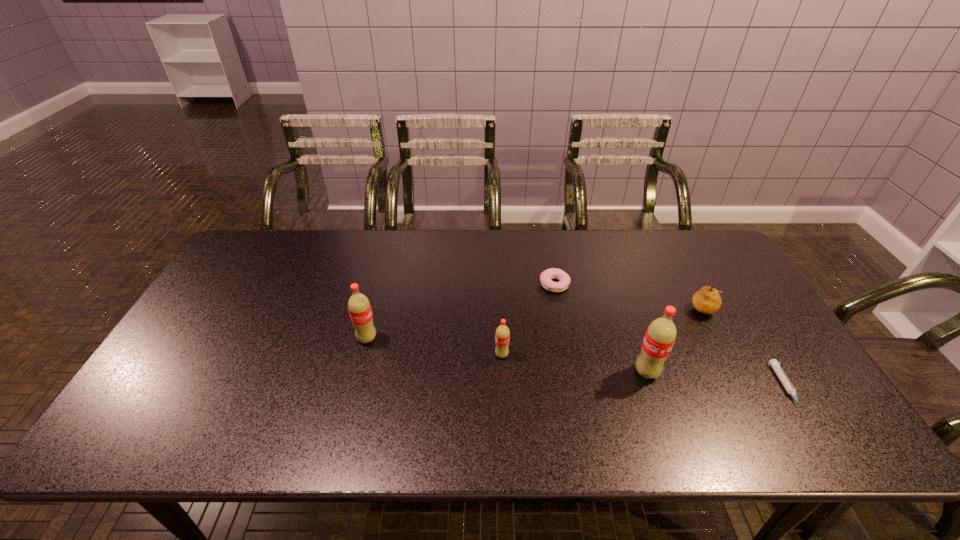
Please show where to add a soda on the right while keeping spacing even. Please provide its 2D coordinates. Your answer should be formatted as a tuple, i.e. [(x, y)], where the tuple contains the x and y coordinates of a point satisfying the conditions above.

[(803, 391)]